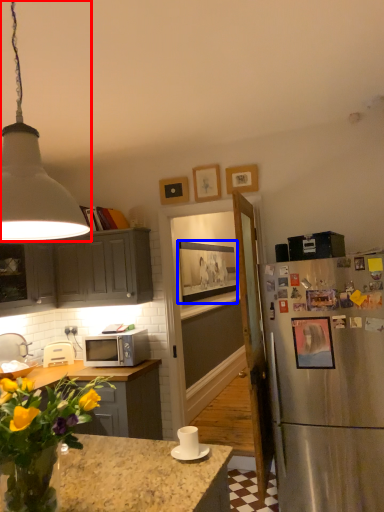
Question: Which point is further to the camera, lamp (highlighted by a red box) or picture frame (highlighted by a blue box)?

Choices:
 (A) lamp
 (B) picture frame

Answer: (B)